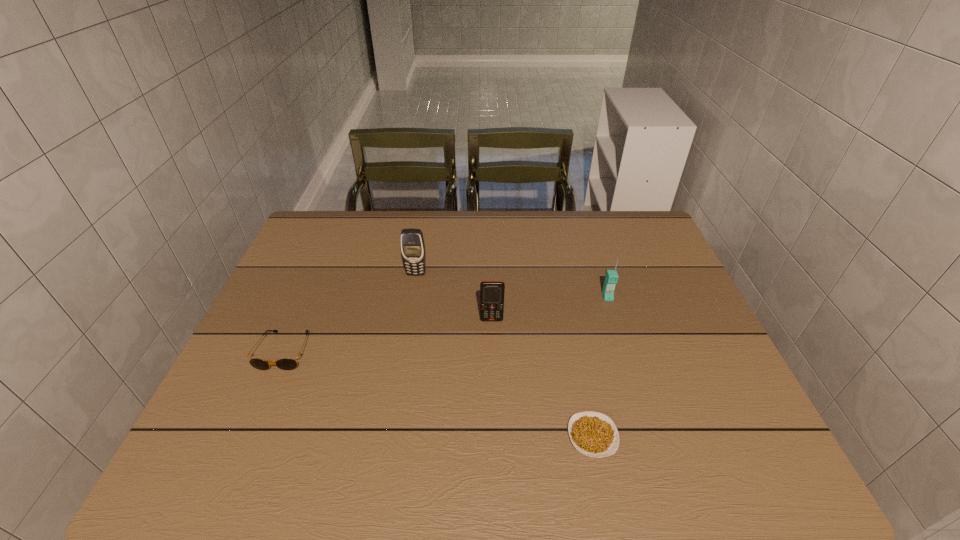
Locate an element on the screen. The height and width of the screenshot is (540, 960). the farthest object is located at coordinates (412, 242).

Where is `the fourth object from right to left`? the fourth object from right to left is located at coordinates (412, 242).

At what (x,y) coordinates should I click in order to perform the action: click on the third object from right to left. Please return your answer as a coordinate pair (x, y). This screenshot has height=540, width=960. Looking at the image, I should click on (491, 292).

Where is `the nearest cellular telephone`? Image resolution: width=960 pixels, height=540 pixels. the nearest cellular telephone is located at coordinates (491, 292).

In order to click on the rightmost cellular telephone in this screenshot , I will do `click(611, 278)`.

Find the location of a particular element. Image resolution: width=960 pixels, height=540 pixels. the second nearest cellular telephone is located at coordinates (611, 278).

Identify the location of sunglasses. click(x=286, y=363).

Where is `the leftmost object`? This screenshot has width=960, height=540. the leftmost object is located at coordinates (286, 363).

The height and width of the screenshot is (540, 960). In order to click on legume in this screenshot , I will do `click(593, 434)`.

Find the location of a particular element. the nearest object is located at coordinates (593, 434).